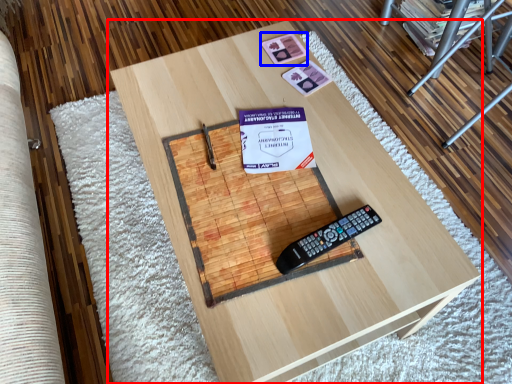
Question: Which object appears farthest to the camera in this image, table (highlighted by a red box) or square (highlighted by a blue box)?

Choices:
 (A) table
 (B) square

Answer: (B)